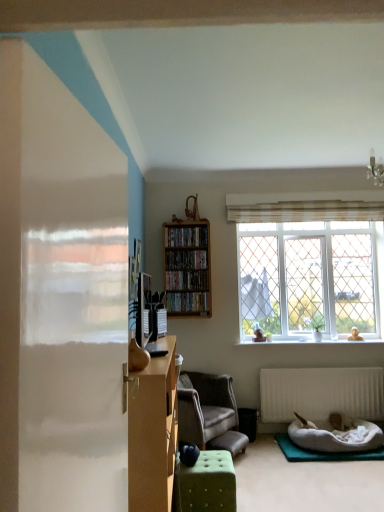
In order to click on free space above white matte radiator at lower center (from a real-world perspective) in this screenshot , I will do [337, 364].